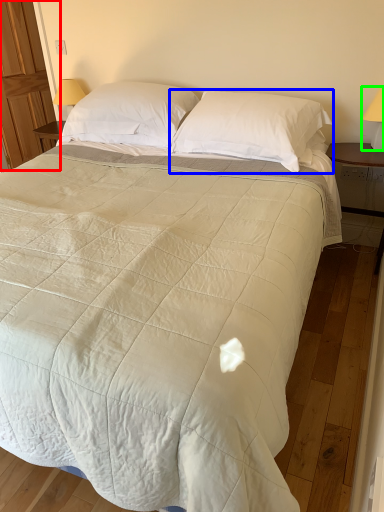
Question: Considering the real-world distances, which object is farthest from armoire (highlighted by a red box)? pillow (highlighted by a blue box) or table lamp (highlighted by a green box)?

Choices:
 (A) pillow
 (B) table lamp

Answer: (B)